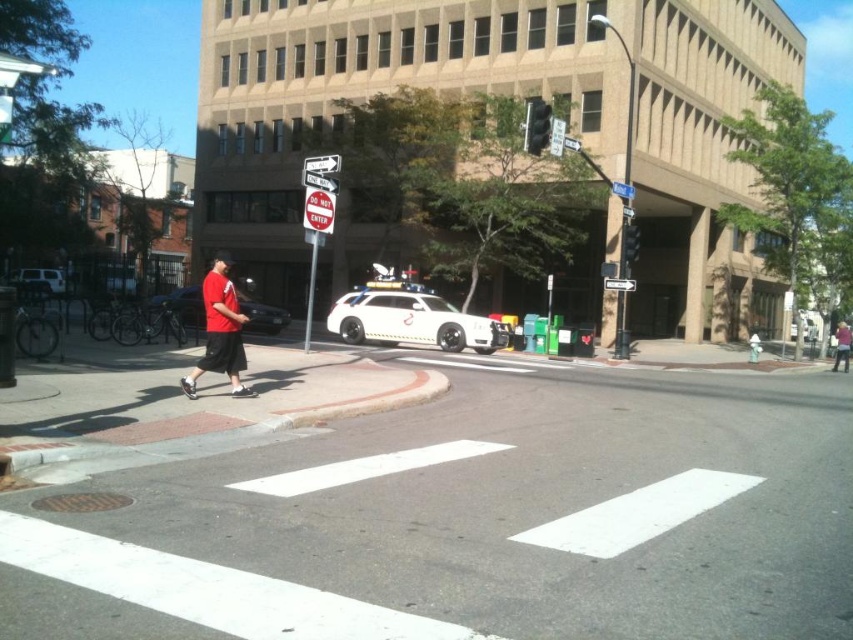
You are a pedestrian standing at the crosswalk and want to cross the street to the store on the other side. You need to check the traffic light first. Which side of the metallic traffic light at upper center should you look towards to see the white glossy suv at center?

The white glossy suv at center is located to the left of the metallic traffic light at upper center, so you should look towards the left side of the metallic traffic light at upper center to see it.

You are a delivery drone that needs to fly from the white glossy suv at center to the metallic traffic light at upper center. What is the shortest distance you must travel?

The shortest distance you must travel is 8.93 meters between the white glossy suv at center and the metallic traffic light at upper center.